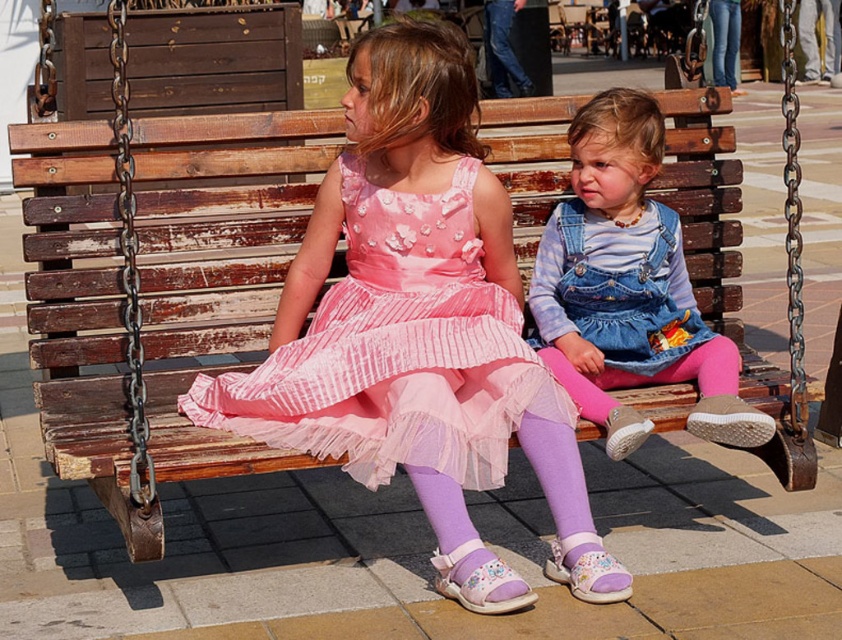
Does point (198, 472) come in front of point (632, 241)?

That is True.

What do you see at coordinates (78, 317) in the screenshot? Image resolution: width=842 pixels, height=640 pixels. I see `wooden swing at center` at bounding box center [78, 317].

Identify the location of wooden swing at center. This screenshot has width=842, height=640. (78, 317).

Between point (498, 444) and point (640, 195), which one is positioned behind?

The point (640, 195) is more distant.

Locate an element on the screen. This screenshot has height=640, width=842. pink tulle dress at center is located at coordinates (397, 349).

Locate an element on the screen. pink tulle dress at center is located at coordinates (397, 349).

Where is `pink tulle dress at center`? This screenshot has width=842, height=640. pink tulle dress at center is located at coordinates (397, 349).

This screenshot has width=842, height=640. I want to click on wooden swing at center, so pos(78,317).

Which of these two, wooden swing at center or pink tulle dress at center, stands taller?

With more height is wooden swing at center.

In order to click on wooden swing at center in this screenshot , I will do (78, 317).